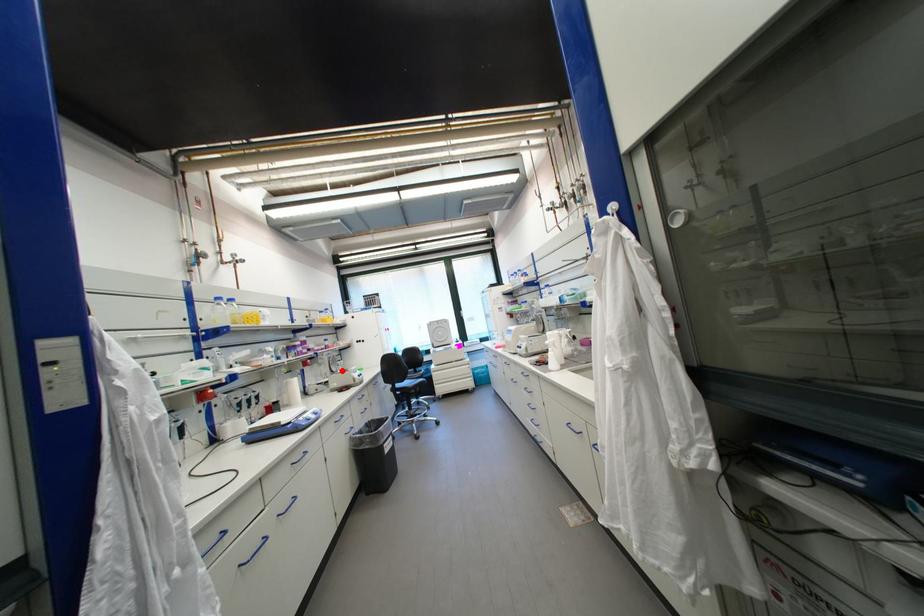
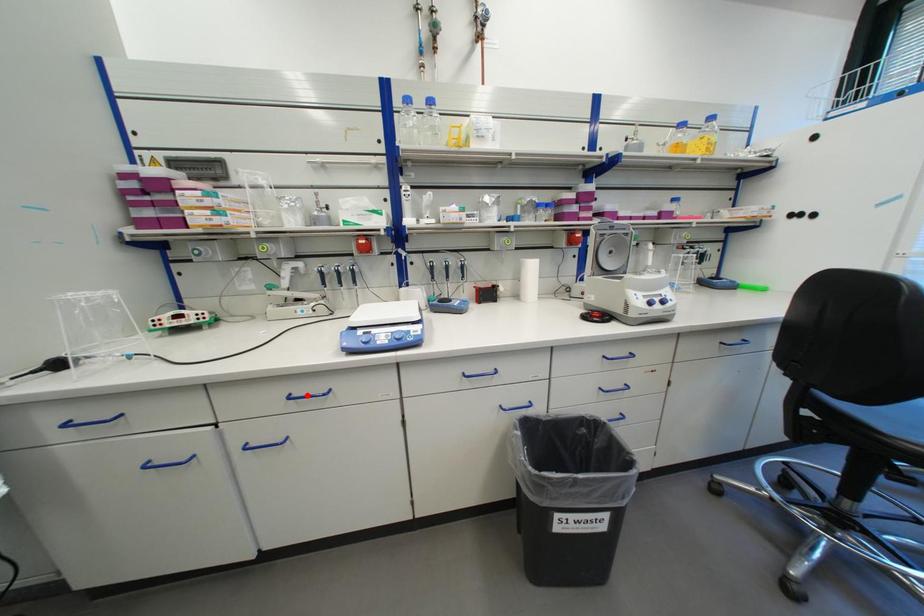
I am providing you with two images of the same scene from different viewpoints. A red point is marked on the first image and another point is marked on the second image. Are the points marked in image1 and image2 representing the same 3D position?

No